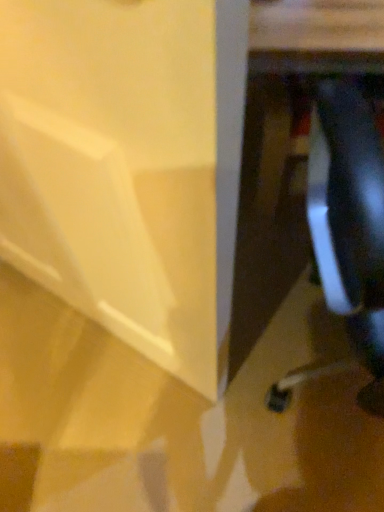
Image resolution: width=384 pixels, height=512 pixels. Identify the location of free point below black leather chair at lower right (from a real-world perspective). (326, 398).